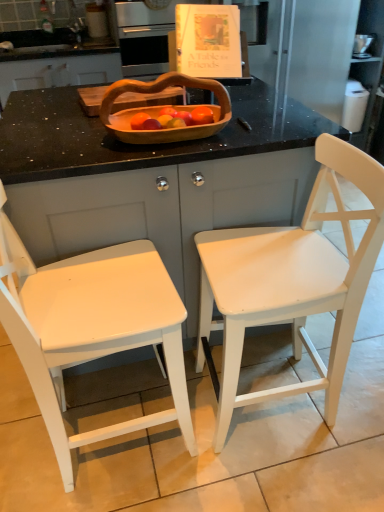
Question: Would you say matte wood counter at center is to the left or to the right of wooden basket at center in the picture?

Choices:
 (A) left
 (B) right

Answer: (A)

Question: Considering their positions, is matte wood counter at center located in front of or behind wooden basket at center?

Choices:
 (A) behind
 (B) front

Answer: (B)

Question: Which of these objects is positioned closest to the matte white book at upper center?

Choices:
 (A) wooden basket at center
 (B) white painted wood chair at right, the 2th chair positioned from the left
 (C) matte wood counter at center
 (D) wooden cutting board at upper center
 (E) white painted wood chair at left, which ranks as the 2th chair in right-to-left order

Answer: (D)

Question: Based on their relative distances, which object is farther from the wooden basket at center?

Choices:
 (A) white painted wood chair at left, which is the first chair in left-to-right order
 (B) white painted wood chair at right, marked as the 1th chair in a right-to-left arrangement
 (C) matte wood counter at center
 (D) matte white book at upper center
 (E) wooden cutting board at upper center

Answer: (D)